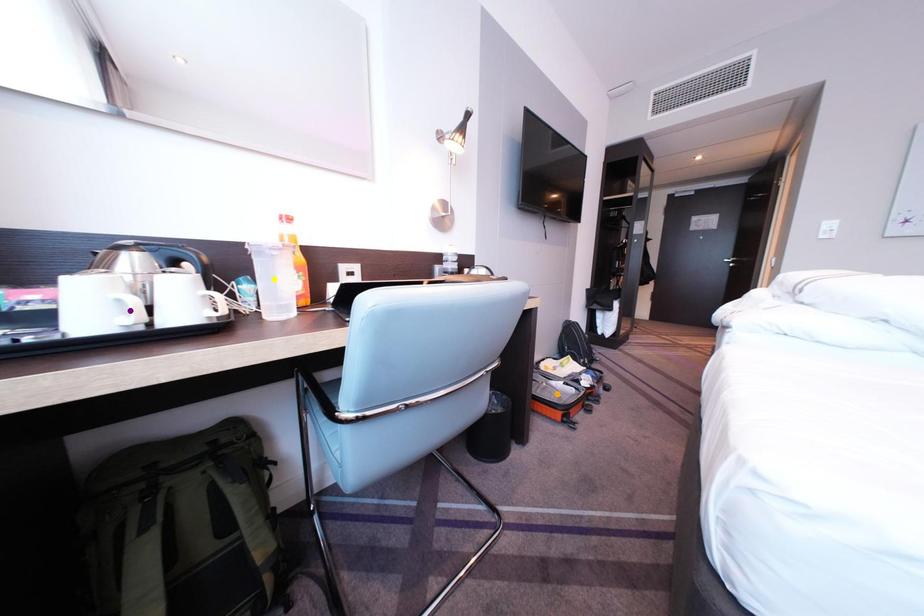
Order these from farthest to nearest:
1. purple point
2. orange point
3. yellow point

1. orange point
2. yellow point
3. purple point